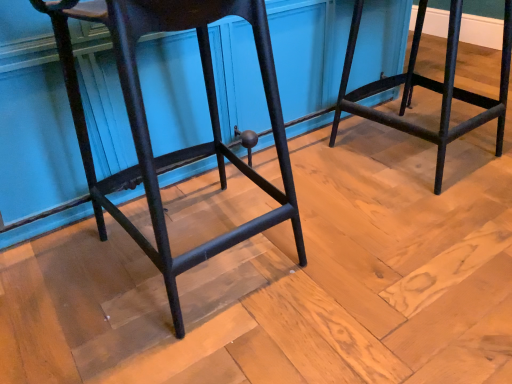
You are a GUI agent. You are given a task and a screenshot of the screen. Output one action in this format:
    pyautogui.click(x=<x>, y=<y>)
    Task: Click on the vacant space underneath matte black stool at center, which is counted as the first furniture, starting from the left (from a real-world perspective)
    
    Given the screenshot: What is the action you would take?
    pyautogui.click(x=221, y=249)